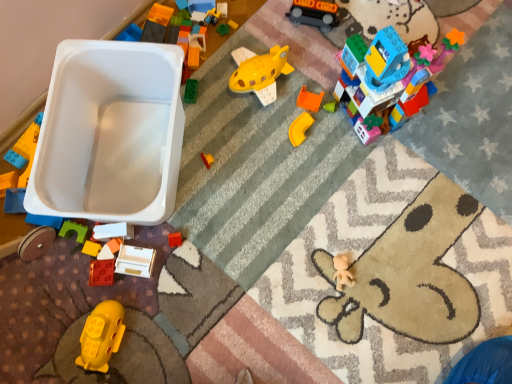
Locate an element on the screen. free space that is in between yellow matte plastic corner piece at center-right, acting as the 6th toy starting from the left, and rubber brick at lower left, the second toy positioned from the bottom is located at coordinates (219, 191).